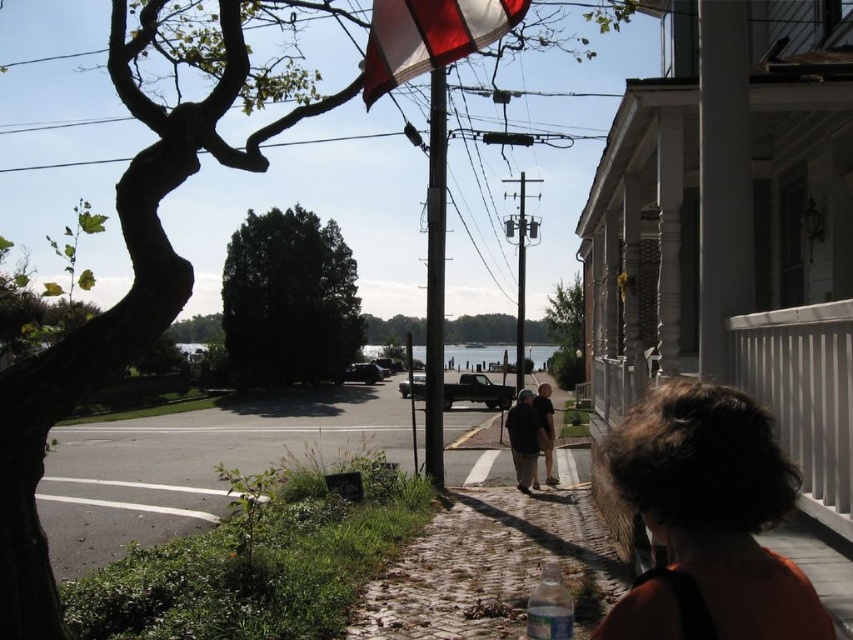
Question: Is red fabric flag at upper center bigger than dark brown leather shoes at center?

Choices:
 (A) yes
 (B) no

Answer: (A)

Question: Is red fabric flag at upper center closer to the viewer compared to dark brown leather shoes at center?

Choices:
 (A) no
 (B) yes

Answer: (B)

Question: Among these objects, which one is nearest to the camera?

Choices:
 (A) dark brown leather shoes at center
 (B) dark brown hair at lower right

Answer: (B)

Question: Which point appears farthest from the camera in this image?

Choices:
 (A) (769, 556)
 (B) (541, 385)

Answer: (B)

Question: Which object appears farthest from the camera in this image?

Choices:
 (A) red fabric flag at upper center
 (B) dark brown leather shoes at center

Answer: (B)

Question: Does dark brown hair at lower right appear over red fabric flag at upper center?

Choices:
 (A) no
 (B) yes

Answer: (A)